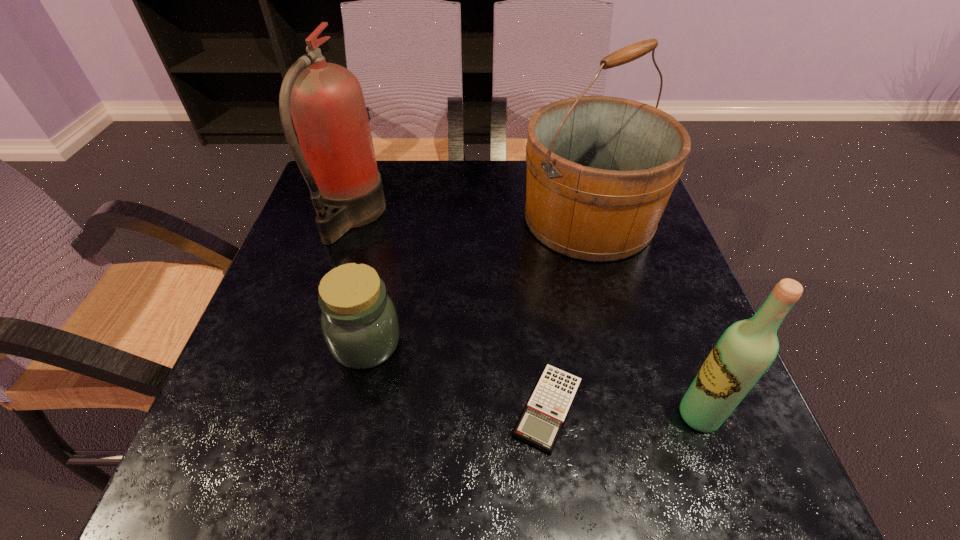
Locate an element on the screen. This screenshot has width=960, height=540. free space between the third shortest object and the calculator is located at coordinates (624, 411).

The width and height of the screenshot is (960, 540). Identify the location of empty space between the third tallest object and the fire extinguisher. (525, 316).

The image size is (960, 540). I want to click on free space between the shortest object and the second shortest object, so click(457, 376).

What are the coordinates of `object that is the third closest to the bucket` in the screenshot? It's located at (747, 348).

Locate an element on the screen. object that ranks as the second closest to the shortest object is located at coordinates (359, 322).

I want to click on vacant area in the image that satisfies the following two spatial constraints: 1. at the nozzle of the fire extinguisher; 2. on the right side of the bucket, so click(349, 219).

You are a GUI agent. You are given a task and a screenshot of the screen. Output one action in this format:
    pyautogui.click(x=<x>, y=<y>)
    Task: Click on the free space that satisfies the following two spatial constraints: 1. at the nozzle of the fire extinguisher; 2. on the back side of the bucket
    This screenshot has height=540, width=960.
    Given the screenshot: What is the action you would take?
    pyautogui.click(x=349, y=219)

Locate an element on the screen. Image resolution: width=960 pixels, height=540 pixels. vacant space that satisfies the following two spatial constraints: 1. on the back side of the bucket; 2. on the right side of the shortest object is located at coordinates (526, 219).

At what (x,y) coordinates should I click in order to perform the action: click on vacant space that satisfies the following two spatial constraints: 1. at the nozzle of the fire extinguisher; 2. on the left side of the bucket. Please return your answer as a coordinate pair (x, y). Looking at the image, I should click on tap(349, 219).

Where is `vacant space that satisfies the following two spatial constraints: 1. on the back side of the bucket; 2. on the left side of the jar`? The height and width of the screenshot is (540, 960). vacant space that satisfies the following two spatial constraints: 1. on the back side of the bucket; 2. on the left side of the jar is located at coordinates (394, 219).